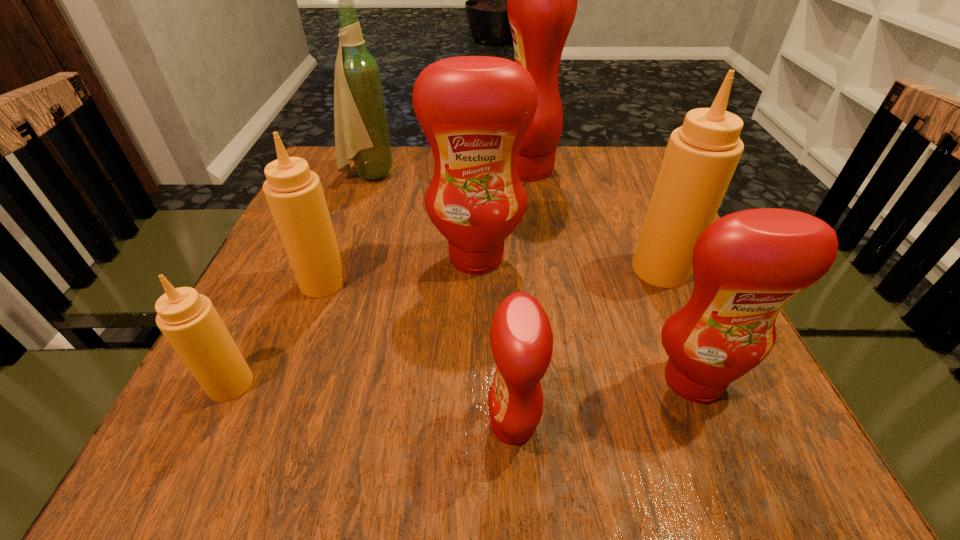
Identify which tan condiment is the third nearest to the wine bottle. Please provide its 2D coordinates. Your answer should be formatted as a tuple, i.e. [(x, y)], where the tuple contains the x and y coordinates of a point satisfying the conditions above.

[(701, 156)]

I want to click on tan condiment that is the nearest to the second farthest red condiment, so click(294, 193).

Image resolution: width=960 pixels, height=540 pixels. Identify the location of vacant region that satisfies the following two spatial constraints: 1. on the back side of the second tan condiment from left to right; 2. on the right side of the nearest tan condiment. (279, 282).